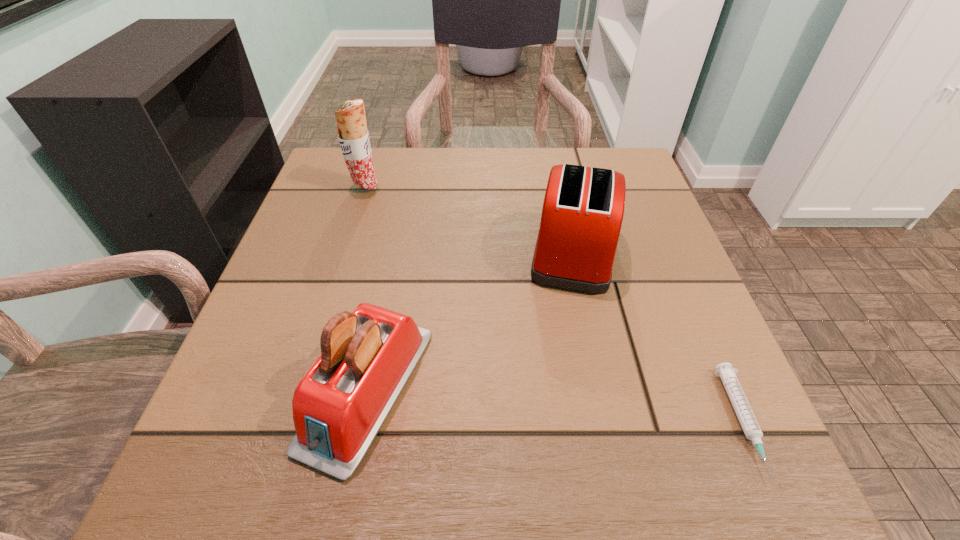
Where is `vacant point located between the farthest object and the right toaster`? vacant point located between the farthest object and the right toaster is located at coordinates (469, 219).

This screenshot has height=540, width=960. I want to click on free space between the burrito and the shortest object, so click(554, 305).

Locate an element on the screen. Image resolution: width=960 pixels, height=540 pixels. blank region between the nearer toaster and the farthest object is located at coordinates (367, 288).

Find the location of a particular element. empty space between the nearer toaster and the syringe is located at coordinates (555, 406).

I want to click on empty space that is in between the tallest object and the right toaster, so click(x=469, y=219).

Identify which object is the closest to the farthest object. Please provide its 2D coordinates. Your answer should be formatted as a tuple, i.e. [(x, y)], where the tuple contains the x and y coordinates of a point satisfying the conditions above.

[(583, 208)]

Locate an element on the screen. object identified as the second closest to the nearer toaster is located at coordinates (353, 136).

At what (x,y) coordinates should I click in order to perform the action: click on free space that satisfies the following two spatial constraints: 1. on the back side of the farther toaster; 2. on the right side of the left toaster. Please return your answer as a coordinate pair (x, y). The image size is (960, 540). Looking at the image, I should click on (395, 251).

You are a GUI agent. You are given a task and a screenshot of the screen. Output one action in this format:
    pyautogui.click(x=<x>, y=<y>)
    Task: Click on the vacant position in the image that satisfies the following two spatial constraints: 1. on the front side of the burrito; 2. on the right side of the nearer toaster
    
    Given the screenshot: What is the action you would take?
    pyautogui.click(x=302, y=389)